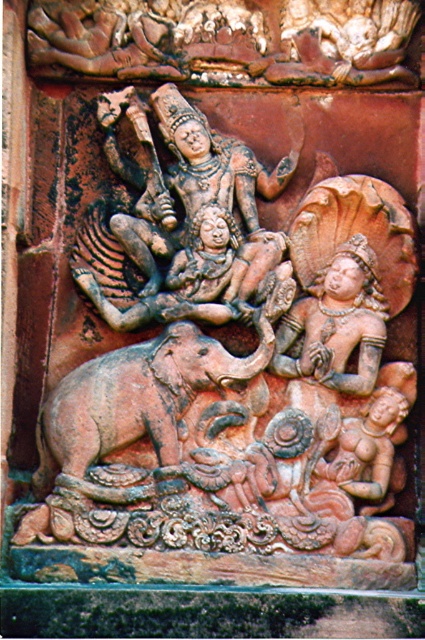
You are an art conservator examining the stone carving. You need to clean the terracotta statue at center and the terracotta elephant at center. Which object should you start with if you want to work from the closest to the farthest point first?

The terracotta statue at center is closer to the viewer than the terracotta elephant at center, so you should start cleaning the terracotta statue at center first.